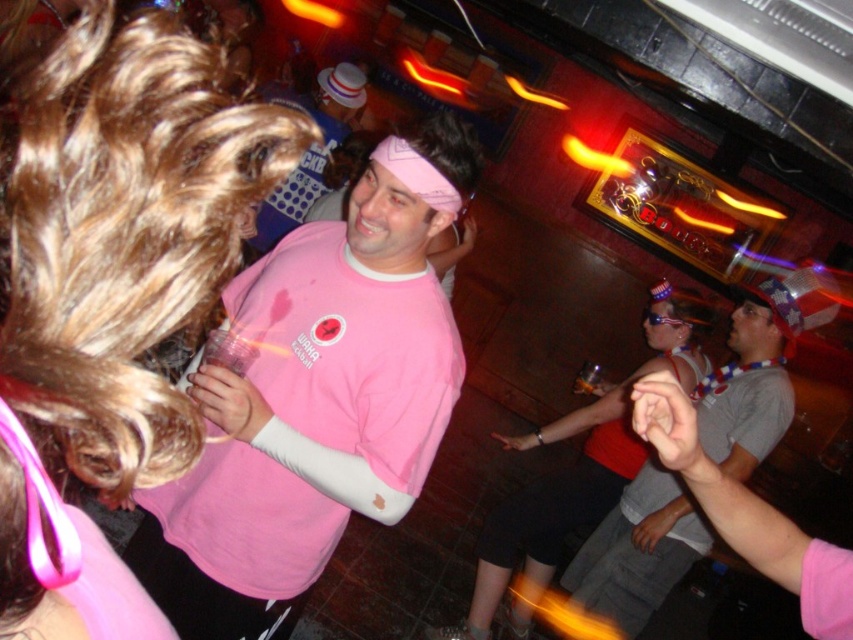
Question: Is matte pink tank top at center closer to the viewer compared to pink matte shirt at center?

Choices:
 (A) yes
 (B) no

Answer: (A)

Question: Considering the real-world distances, which object is farthest from the matte pink tank top at center?

Choices:
 (A) pink matte shirt at center
 (B) pink matte t-shirt at center

Answer: (A)

Question: Considering the relative positions of matte pink tank top at center and pink matte shirt at center in the image provided, where is matte pink tank top at center located with respect to pink matte shirt at center?

Choices:
 (A) left
 (B) right

Answer: (B)

Question: Based on their relative distances, which object is nearer to the pink matte shirt at center?

Choices:
 (A) pink fabric shirt at upper left
 (B) matte pink tank top at center
 (C) pink matte t-shirt at center

Answer: (B)

Question: Can you confirm if pink fabric shirt at upper left is wider than pink matte t-shirt at center?

Choices:
 (A) no
 (B) yes

Answer: (A)

Question: Which point is closer to the camera?

Choices:
 (A) (155, 436)
 (B) (357, 67)
 (C) (587, 506)

Answer: (A)